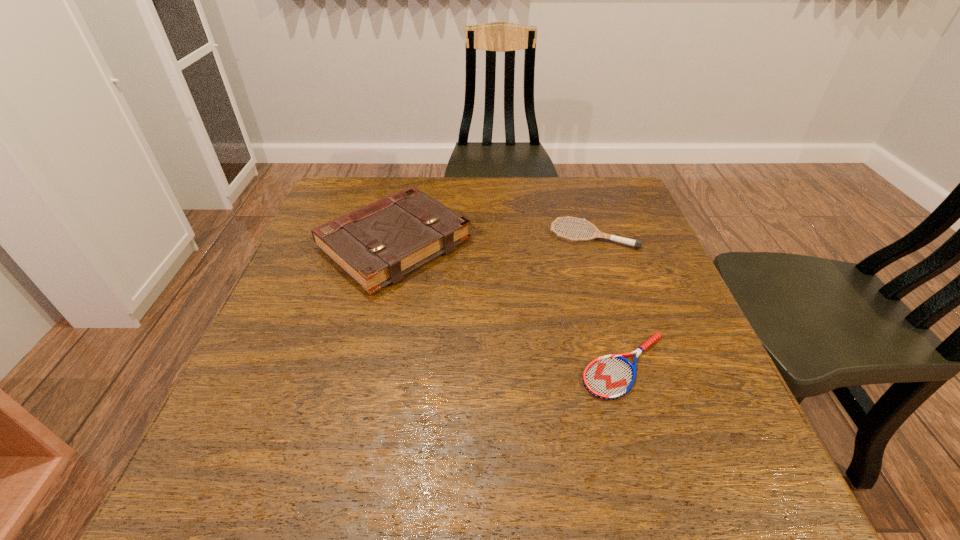
I want to click on the tallest object, so click(x=376, y=245).

You are a GUI agent. You are given a task and a screenshot of the screen. Output one action in this format:
    pyautogui.click(x=<x>, y=<y>)
    Task: Click on the hardback book
    
    Given the screenshot: What is the action you would take?
    pyautogui.click(x=376, y=245)

You are a GUI agent. You are given a task and a screenshot of the screen. Output one action in this format:
    pyautogui.click(x=<x>, y=<y>)
    Task: Click on the second tallest object
    
    Given the screenshot: What is the action you would take?
    pyautogui.click(x=636, y=243)

Identify the location of the farther tennis racket. This screenshot has height=540, width=960. [x=636, y=243].

This screenshot has height=540, width=960. Find the location of `the nearer tennis racket`. the nearer tennis racket is located at coordinates (609, 377).

I want to click on the shortest object, so click(609, 377).

This screenshot has width=960, height=540. I want to click on free space located on the front of the tallest object, so click(369, 353).

Image resolution: width=960 pixels, height=540 pixels. Find the location of `free space located on the left of the second shortest object`. free space located on the left of the second shortest object is located at coordinates (531, 235).

At what (x,y) coordinates should I click in order to perform the action: click on free space located 0.310m on the back of the nearest object. Please return your answer as a coordinate pair (x, y). Image resolution: width=960 pixels, height=540 pixels. Looking at the image, I should click on (588, 242).

Identify the location of hardback book that is at the far edge. (376, 245).